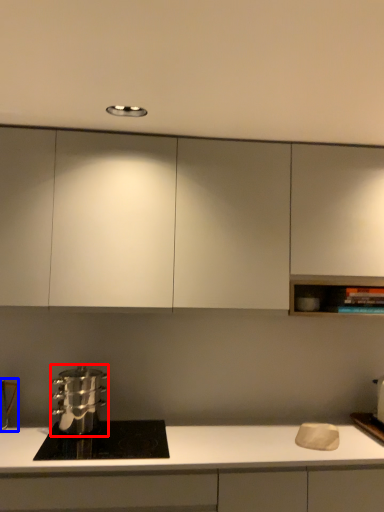
Question: Which object appears closest to the camera in this image, kitchen appliance (highlighted by a red box) or appliance (highlighted by a blue box)?

Choices:
 (A) kitchen appliance
 (B) appliance

Answer: (A)